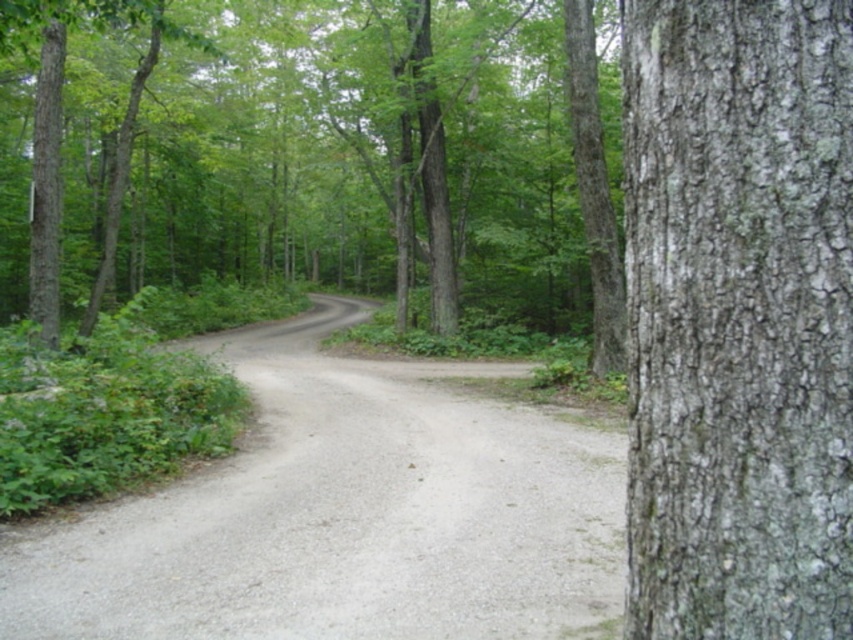
Is point (15, 244) farther from camera compared to point (753, 609)?

That is True.

Can you confirm if rough bark tree at center is positioned below gray rough bark at right?

Actually, rough bark tree at center is above gray rough bark at right.

You are a GUI agent. You are given a task and a screenshot of the screen. Output one action in this format:
    pyautogui.click(x=<x>, y=<y>)
    Task: Click on the rough bark tree at center
    This screenshot has width=853, height=640.
    Given the screenshot: What is the action you would take?
    pyautogui.click(x=314, y=156)

I want to click on gray rough bark at right, so click(738, 316).

Can you confirm if gray rough bark at right is bigger than gray gravel trail at center?

No, gray rough bark at right is not bigger than gray gravel trail at center.

Which is in front, point (751, 276) or point (352, 438)?

Point (751, 276) is in front.

You are a GUI agent. You are given a task and a screenshot of the screen. Output one action in this format:
    pyautogui.click(x=<x>, y=<y>)
    Task: Click on the gray rough bark at right
    
    Given the screenshot: What is the action you would take?
    pyautogui.click(x=738, y=316)

Which is more to the right, rough bark tree at center or gray gravel trail at center?

gray gravel trail at center is more to the right.

Does point (263, 22) come farther from viewer compared to point (99, 614)?

That is True.

The height and width of the screenshot is (640, 853). What do you see at coordinates (314, 156) in the screenshot? I see `rough bark tree at center` at bounding box center [314, 156].

Where is `rough bark tree at center`? The height and width of the screenshot is (640, 853). rough bark tree at center is located at coordinates (314, 156).